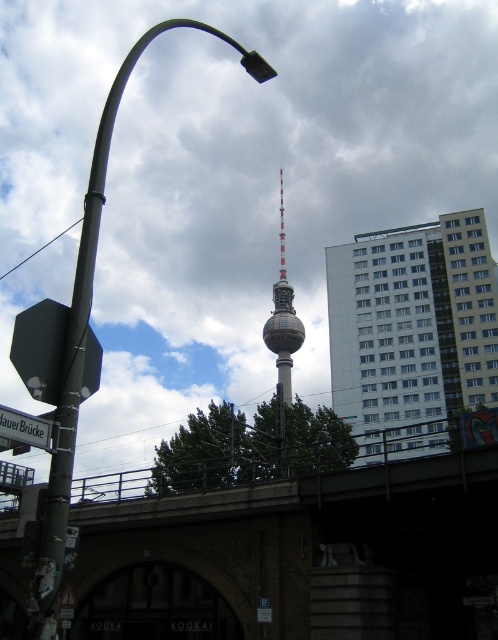
Question: Which object appears farthest from the camera in this image?

Choices:
 (A) white glass building at upper right
 (B) white plastic street sign at lower left
 (C) silver metallic tower at center
 (D) brick bridge at center

Answer: (C)

Question: Which of these objects is positioned farthest from the white glass building at upper right?

Choices:
 (A) silver metallic tower at center
 (B) metallic streetlight at left

Answer: (B)

Question: Is metallic streetlight at left to the right of white plastic street sign at lower left from the viewer's perspective?

Choices:
 (A) no
 (B) yes

Answer: (A)

Question: Can you confirm if metallic streetlight at left is positioned above silver metallic tower at center?

Choices:
 (A) yes
 (B) no

Answer: (A)

Question: Is silver metallic tower at center to the left of white plastic street sign at lower left from the viewer's perspective?

Choices:
 (A) no
 (B) yes

Answer: (A)

Question: Which point is farther from the camera taking this photo?

Choices:
 (A) (364, 589)
 (B) (0, 412)
 (C) (280, 365)
 (D) (474, 292)

Answer: (C)